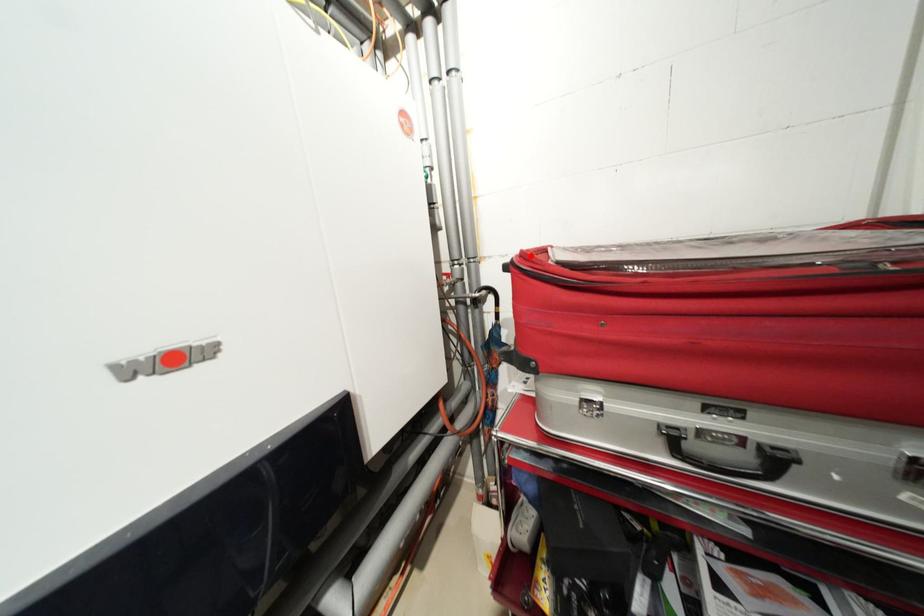
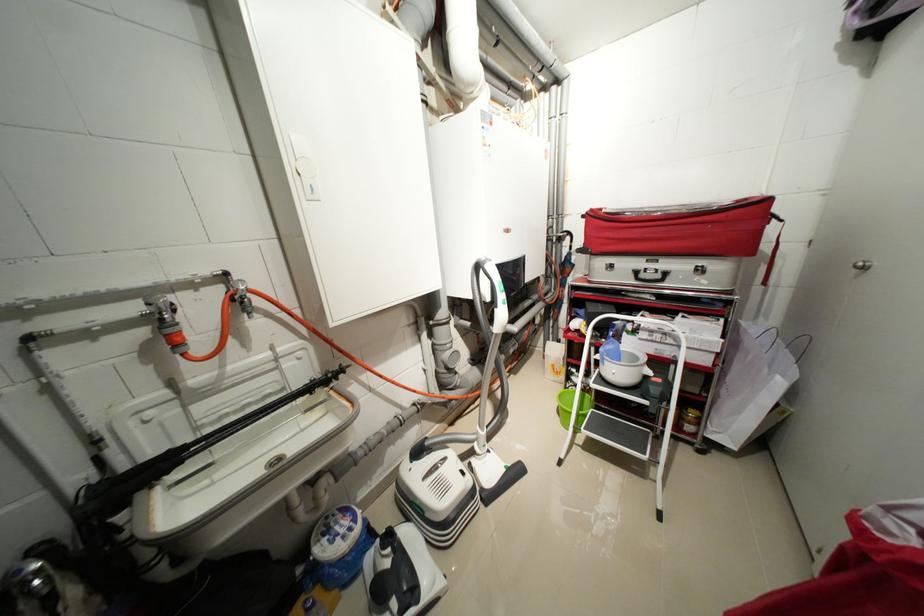
Question: I am providing you with two images of the same scene from different viewpoints. A red point is marked on the first image. Is the red point's position out of view in image 2?

Choices:
 (A) Yes
 (B) No

Answer: (B)